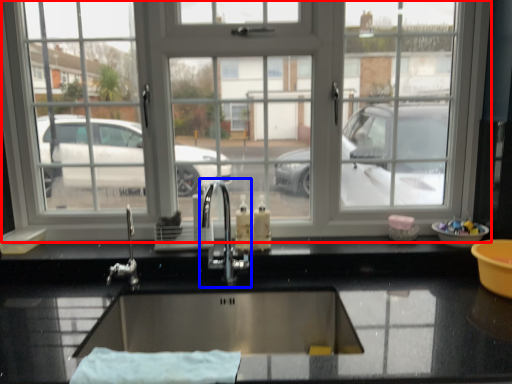
Question: Which object appears closest to the camera in this image, window (highlighted by a red box) or tap (highlighted by a blue box)?

Choices:
 (A) window
 (B) tap

Answer: (B)